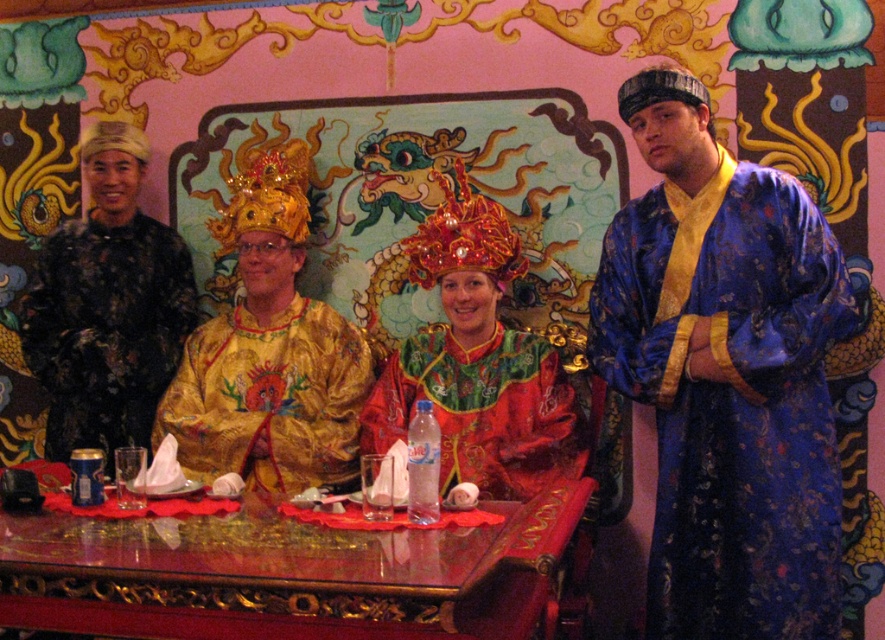
Which is in front, point (640, 259) or point (278, 529)?

Positioned in front is point (278, 529).

I want to click on blue silk robe at center, so click(x=726, y=374).

Who is more forward, [154,522] or [340,339]?

Positioned in front is point [154,522].

Based on the photo, which is more to the left, glossy wooden table at center or gold shiny robe at center?

gold shiny robe at center

The height and width of the screenshot is (640, 885). Find the location of `glossy wooden table at center`. glossy wooden table at center is located at coordinates (285, 573).

Where is `shiny red fabric dress at center`? This screenshot has height=640, width=885. shiny red fabric dress at center is located at coordinates (476, 362).

Does shiny red fabric dress at center have a greater width compared to gold shiny robe at center?

No.

Identify the location of shiny red fabric dress at center. The width and height of the screenshot is (885, 640). (476, 362).